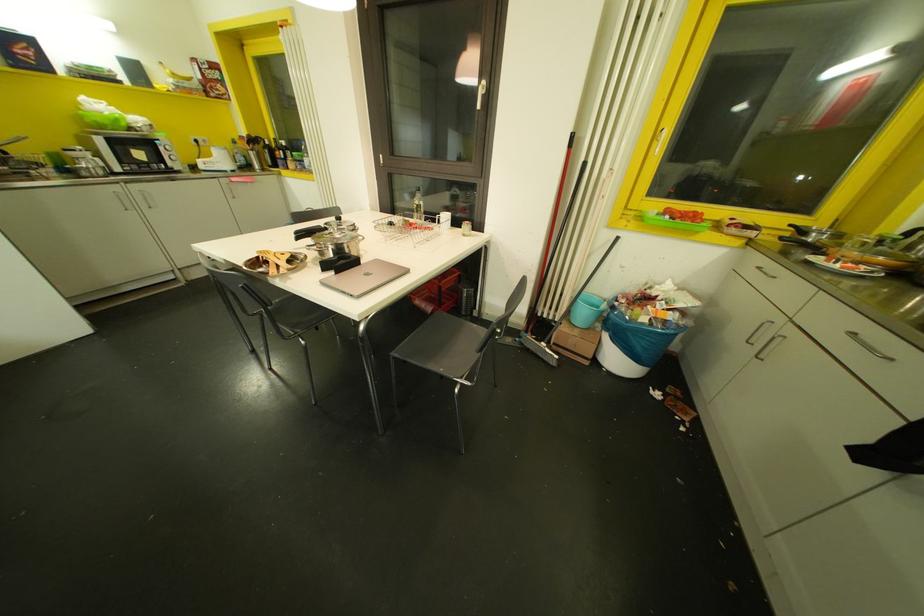
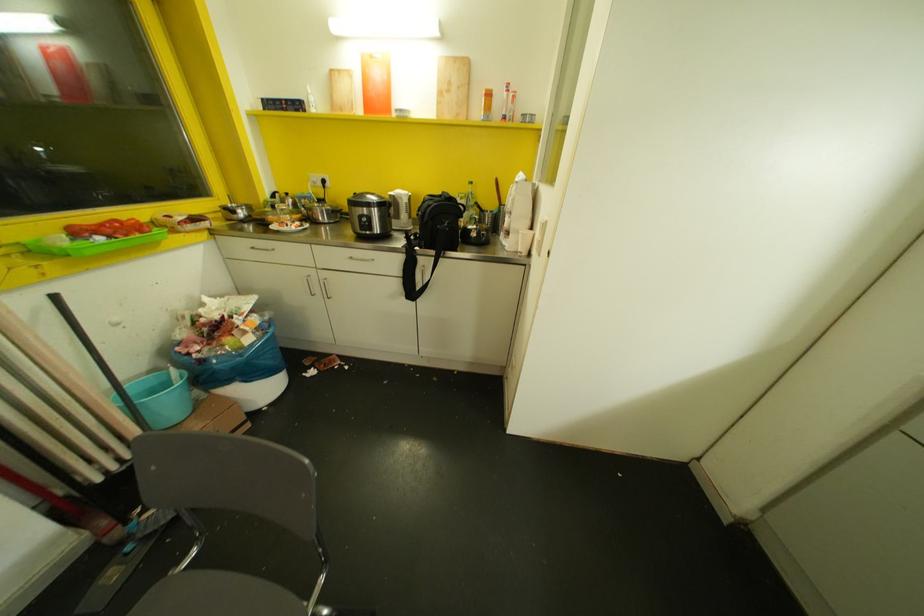
In the second image, find the point that corresponds to pixel 669 217 in the first image.

(99, 237)